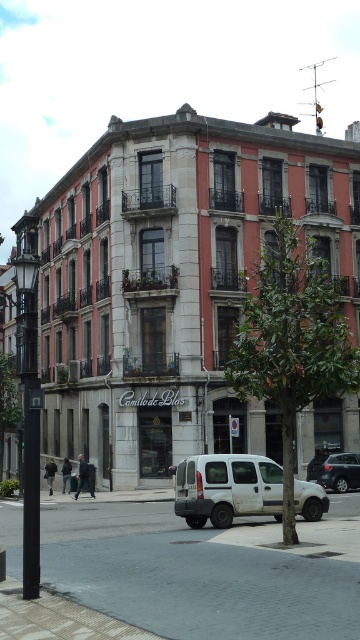
Question: Is black metal pole at left positioned in front of metallic silver van at center?

Choices:
 (A) yes
 (B) no

Answer: (A)

Question: Considering the relative positions of white matte van at lower center and metallic silver van at center in the image provided, where is white matte van at lower center located with respect to metallic silver van at center?

Choices:
 (A) above
 (B) below

Answer: (A)

Question: Which of the following is the closest to the observer?

Choices:
 (A) (344, 488)
 (B) (38, 484)
 (C) (272, 467)

Answer: (B)

Question: Which object is farther from the camera taking this photo?

Choices:
 (A) black metal pole at left
 (B) metallic silver van at center

Answer: (B)

Question: Is white matte van at lower center above black metal pole at left?

Choices:
 (A) yes
 (B) no

Answer: (B)

Question: Which object appears farthest from the camera in this image?

Choices:
 (A) metallic silver van at center
 (B) white matte van at lower center
 (C) black metal pole at left

Answer: (A)